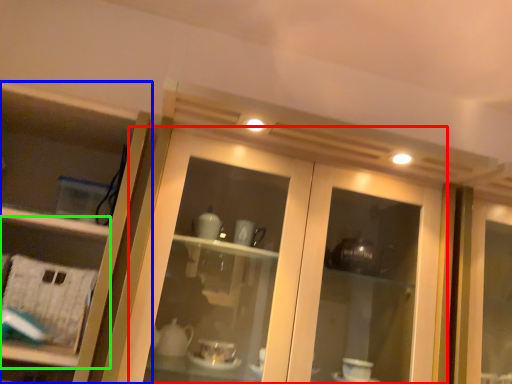
Question: Estimate the real-world distances between objects in this image. Which object is closer to door (highlighted by a red box), cupboard (highlighted by a blue box) or shelf (highlighted by a green box)?

Choices:
 (A) cupboard
 (B) shelf

Answer: (A)